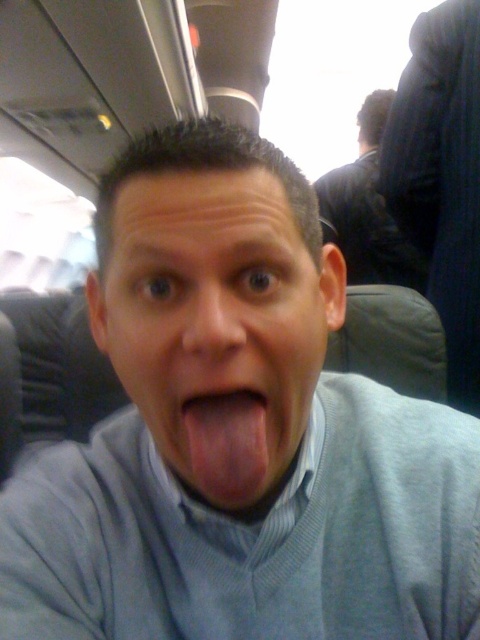
Question: From the image, what is the correct spatial relationship of pink flesh-colored tongue at center in relation to smooth skin nose at center?

Choices:
 (A) right
 (B) left

Answer: (A)

Question: Which object is positioned closest to the dark blue sweater at upper right?

Choices:
 (A) gray matte face at center
 (B) pink flesh-colored tongue at center
 (C) smooth skin nose at center

Answer: (A)

Question: Does dark blue sweater at upper right appear on the left side of smooth skin nose at center?

Choices:
 (A) yes
 (B) no

Answer: (B)

Question: Estimate the real-world distances between objects in this image. Which object is closer to the gray matte face at center?

Choices:
 (A) dark blue sweater at upper right
 (B) pink flesh-colored tongue at center
 (C) smooth skin nose at center

Answer: (B)

Question: Based on their relative distances, which object is nearer to the dark blue sweater at upper right?

Choices:
 (A) pink flesh-colored tongue at center
 (B) gray matte face at center
 (C) smooth skin nose at center

Answer: (B)

Question: Does gray matte face at center have a lesser width compared to dark blue sweater at upper right?

Choices:
 (A) no
 (B) yes

Answer: (B)